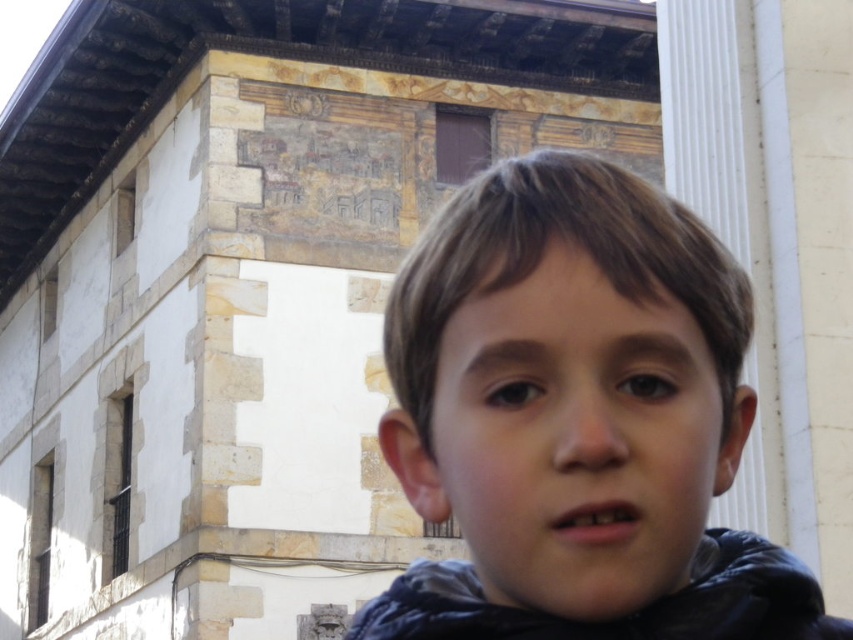
Question: Among these objects, which one is nearest to the camera?

Choices:
 (A) dark blue fleece at center
 (B) dark blue fleece jacket at lower right

Answer: (A)

Question: Which of the following is the closest to the observer?

Choices:
 (A) dark blue fleece at center
 (B) dark blue fleece jacket at lower right

Answer: (A)

Question: Can you confirm if dark blue fleece at center is smaller than dark blue fleece jacket at lower right?

Choices:
 (A) yes
 (B) no

Answer: (B)

Question: Can you confirm if dark blue fleece at center is positioned to the left of dark blue fleece jacket at lower right?

Choices:
 (A) yes
 (B) no

Answer: (B)

Question: Is dark blue fleece at center positioned behind dark blue fleece jacket at lower right?

Choices:
 (A) yes
 (B) no

Answer: (B)